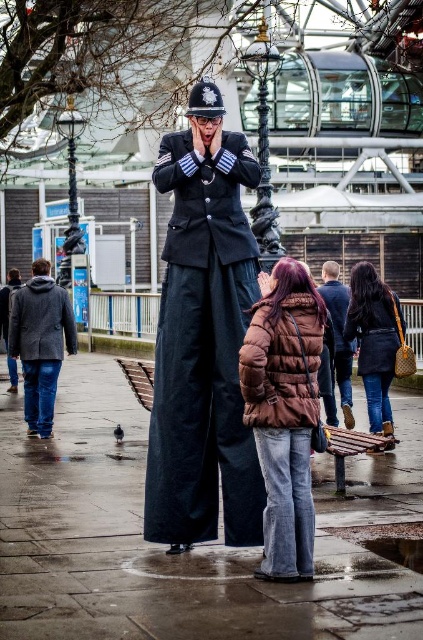
Where is the gray woolen coat at left located in the image?

The gray woolen coat at left is located at the coordinates point (41, 342).

You are a photographer trying to capture the performer on stilts in the background. You want to ensure the brown puffy coat at center is in the frame. Where should you position yourself to include both the performer and the coat?

Since the brown puffy coat at center is at point (337, 344), you should position yourself so that your camera includes this coordinate to capture both the performer and the coat.

You are a delivery person who needs to deliver a package to someone wearing a gray woolen coat at left and another to someone wearing a brown puffy coat at center. The delivery robot you are using has a maximum delivery range of 10 meters. Can you deliver both packages without moving the robot?

The gray woolen coat at left and brown puffy coat at center are 12.40 meters apart. Since the robot can only deliver within 10 meters, you cannot deliver both packages without moving the robot.